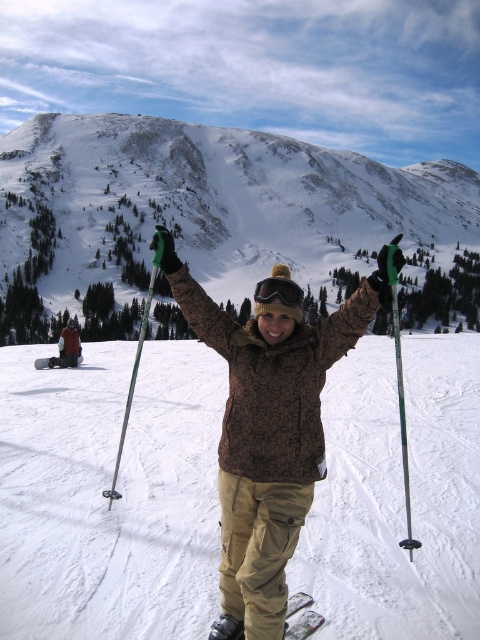
You are a photographer trying to capture the skier in the image. You want to ensure both the brown fuzzy jacket at center and the white matte ski at lower center are clearly visible in your shot. Given their potential sizes, which object might require you to adjust your camera angle to avoid cropping?

The brown fuzzy jacket at center might be wider than the white matte ski at lower center, so adjusting the camera angle to accommodate its width could help ensure both are visible.

You are the skier in the image and want to take a photo of the snowy rocky mountain at upper center. Which direction should you turn your head to look towards it from the metallic silver ski pole at center?

The snowy rocky mountain at upper center is to the right of the metallic silver ski pole at center, so you should turn your head to the right to look towards it.

You are a photographer planning to capture a wide shot of the snowy rocky mountain at upper center and the brown fuzzy jacket at center. Based on their sizes, which object should you focus on first to ensure it fits entirely within the frame?

The snowy rocky mountain at upper center is wider than the brown fuzzy jacket at center, so you should focus on capturing the snowy rocky mountain at upper center first to ensure it fits entirely within the frame.